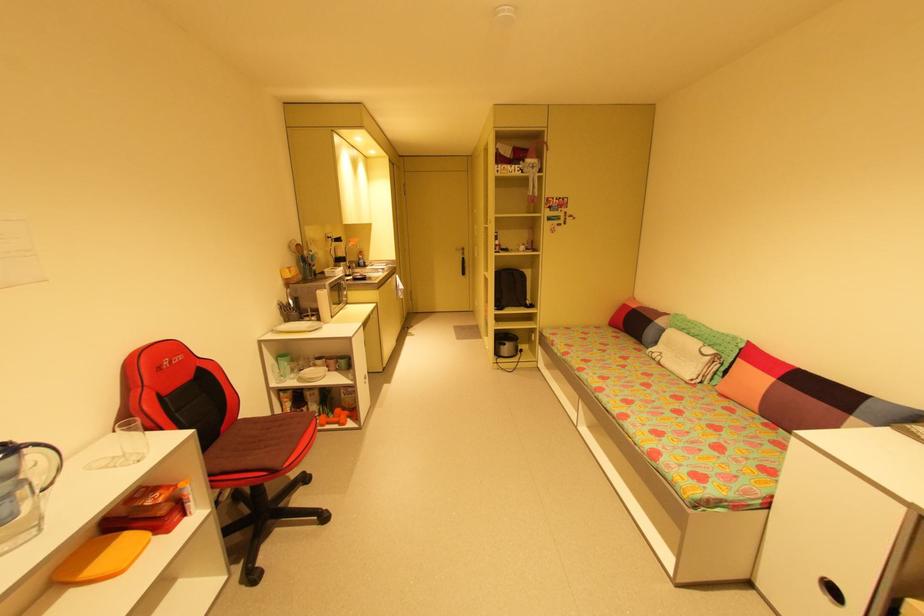
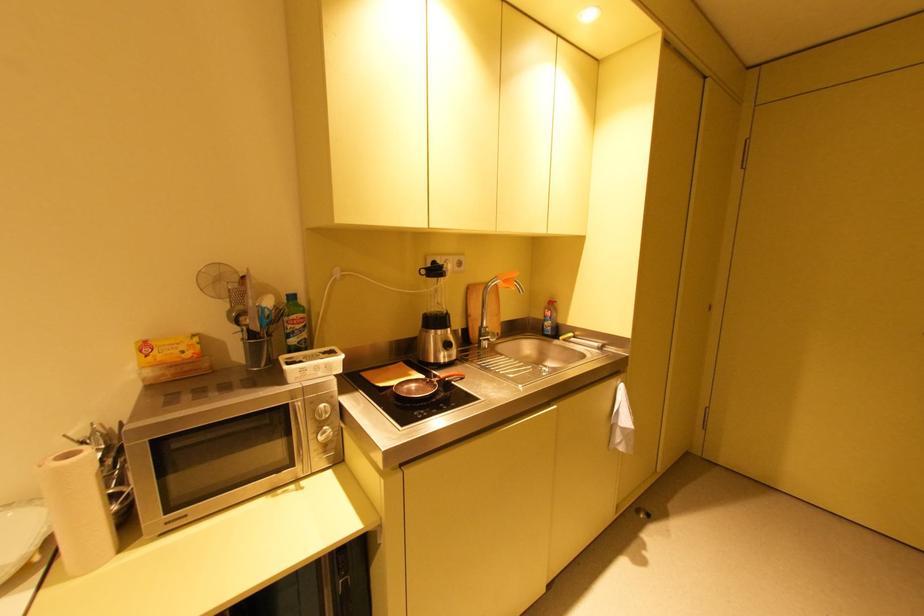
Where in the second image is the point corresponding to the point at 345,238 from the first image?

(444, 267)